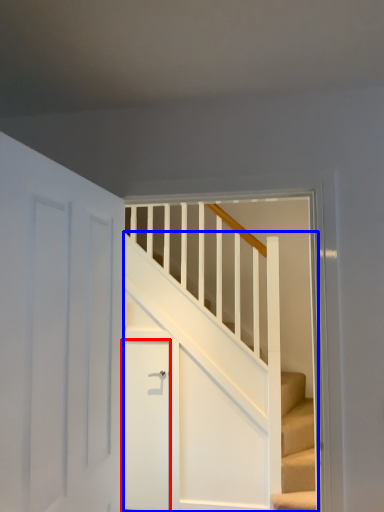
Question: Which point is further to the camera, door (highlighted by a red box) or stairs (highlighted by a blue box)?

Choices:
 (A) door
 (B) stairs

Answer: (A)